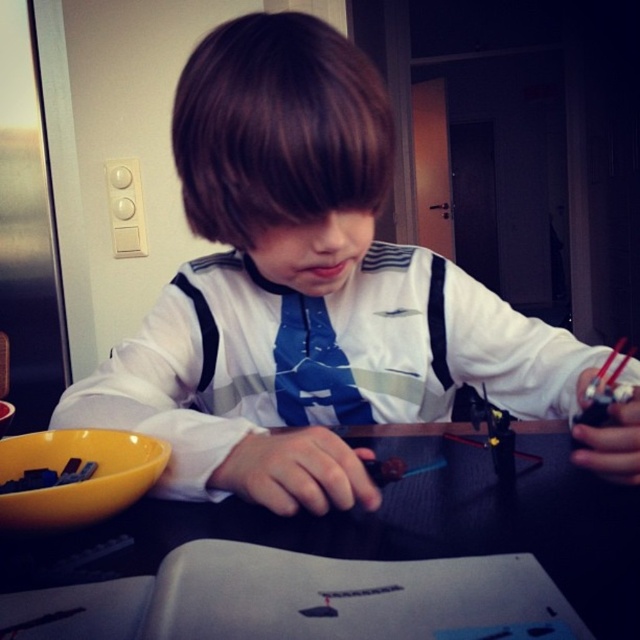
You are a photographer setting up a shoot. You need to ensure that the white matte shirt at center and the black plastic table at center are visible in your composition. Based on their positions, which object should you adjust your camera angle to focus on first to capture both effectively?

The white matte shirt at center is above the black plastic table at center, so you should focus on the black plastic table at center first to ensure both are in frame.

You are a tailor measuring the space between the black plastic table at center and the blue fabric tie at center for a custom fitting. The minimum required space for the fitting is 8 inches. Can you confirm if the space is sufficient?

The distance between the black plastic table at center and the blue fabric tie at center is 8.47 inches, which exceeds the minimum required 8 inches. Therefore, the space is sufficient for the fitting.

You are a tailor who needs to determine if the white matte shirt at center can be folded and placed on the black plastic table at center without overlapping the edges. Based on the scene description, can you confirm if this is possible?

The white matte shirt at center has a larger width than the black plastic table at center, so folding it might still result in overlapping edges when placed on the table.